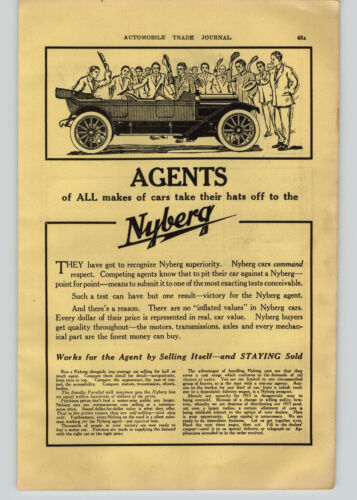
Identify the location of columns. (104, 423), (246, 424).